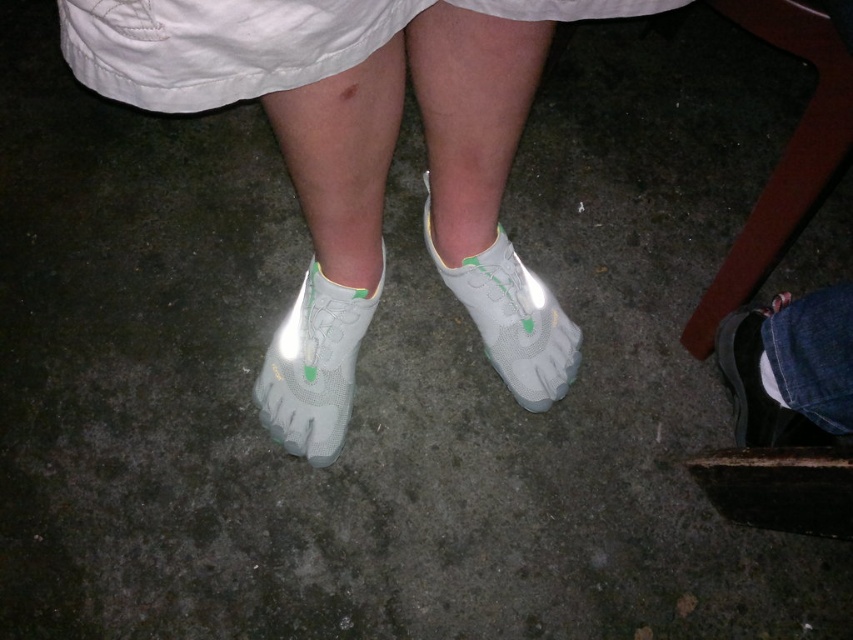
You are an interior designer trying to place a small plant pot at point 0.577, 0.927. You see the denim pants at lower right. Can you place the plant pot there?

The denim pants at lower right is located at point (790, 369), so you cannot place the plant pot there as it is already occupied by the denim pants at lower right.

You are organizing a closet and need to decide where to place the white cotton dress at upper center and the denim pants at lower right. Since space is limited, you want to know which item takes up more space. Based on the image, which item requires more storage space?

The white cotton dress at upper center is larger in size than the denim pants at lower right, so it requires more storage space.